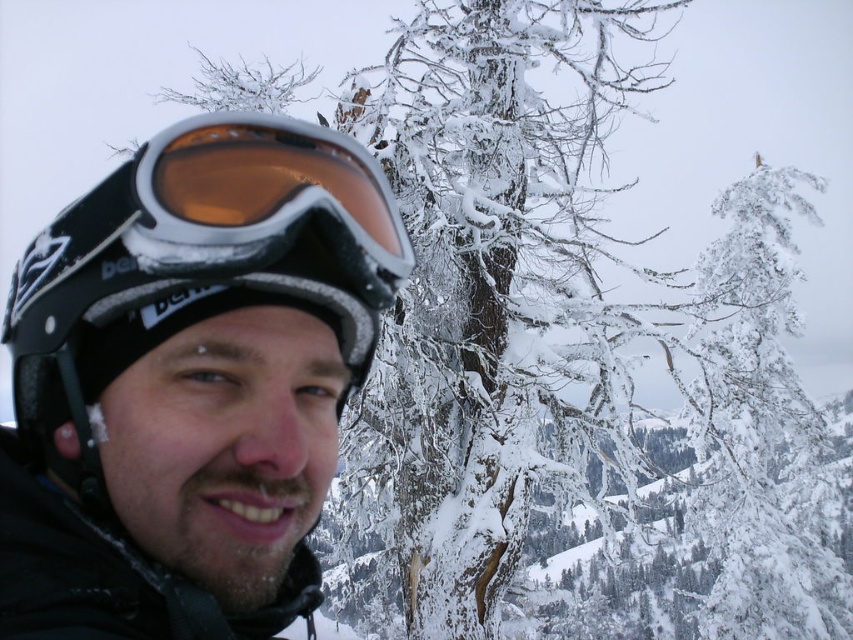
Question: Can you confirm if matte black helmet at left is smaller than matte black goggles at left?

Choices:
 (A) yes
 (B) no

Answer: (B)

Question: Is matte black helmet at left thinner than matte black goggles at left?

Choices:
 (A) no
 (B) yes

Answer: (A)

Question: Is matte black helmet at left to the right of matte black goggles at left from the viewer's perspective?

Choices:
 (A) yes
 (B) no

Answer: (B)

Question: Which of the following is the farthest from the observer?

Choices:
 (A) matte black goggles at left
 (B) matte black helmet at left

Answer: (A)

Question: Which of the following is the closest to the observer?

Choices:
 (A) (164, 246)
 (B) (357, 150)

Answer: (A)